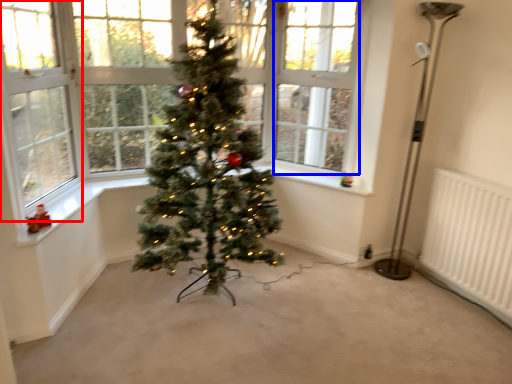
Question: Among these objects, which one is farthest to the camera, window screen (highlighted by a red box) or window screen (highlighted by a blue box)?

Choices:
 (A) window screen
 (B) window screen

Answer: (B)